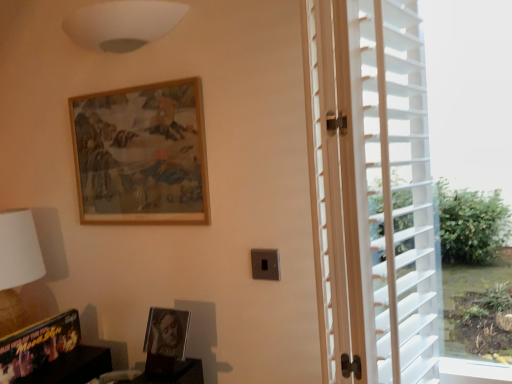
Question: Can you confirm if wooden frame at upper center, which is the third picture frame in bottom-to-top order, is positioned to the right of white matte lampshade at upper center?

Choices:
 (A) no
 (B) yes

Answer: (B)

Question: Can you confirm if wooden frame at upper center, placed as the 1th picture frame when sorted from top to bottom, is positioned to the left of white matte lampshade at upper center?

Choices:
 (A) no
 (B) yes

Answer: (A)

Question: Does wooden frame at upper center, placed as the 1th picture frame when sorted from top to bottom, come in front of white matte lampshade at upper center?

Choices:
 (A) yes
 (B) no

Answer: (B)

Question: Can you confirm if wooden frame at upper center, which is the third picture frame in bottom-to-top order, is wider than white matte lampshade at upper center?

Choices:
 (A) no
 (B) yes

Answer: (A)

Question: Is wooden frame at upper center, placed as the 1th picture frame when sorted from top to bottom, further to camera compared to white matte lampshade at upper center?

Choices:
 (A) yes
 (B) no

Answer: (A)

Question: Based on their sizes in the image, would you say white plastic blinds at right is bigger or smaller than dark wood bookshelf at lower left?

Choices:
 (A) big
 (B) small

Answer: (A)

Question: Considering the positions of white plastic blinds at right and dark wood bookshelf at lower left in the image, is white plastic blinds at right taller or shorter than dark wood bookshelf at lower left?

Choices:
 (A) short
 (B) tall

Answer: (B)

Question: Considering the positions of white plastic blinds at right and dark wood bookshelf at lower left in the image, is white plastic blinds at right wider or thinner than dark wood bookshelf at lower left?

Choices:
 (A) wide
 (B) thin

Answer: (B)

Question: Is point (506, 94) positioned closer to the camera than point (71, 350)?

Choices:
 (A) farther
 (B) closer

Answer: (B)

Question: Is white matte lampshade at upper center situated inside white fabric lampshade at left or outside?

Choices:
 (A) inside
 (B) outside

Answer: (B)

Question: Considering their positions, is white matte lampshade at upper center located in front of or behind white fabric lampshade at left?

Choices:
 (A) front
 (B) behind

Answer: (A)

Question: From the image's perspective, is white matte lampshade at upper center located above or below white fabric lampshade at left?

Choices:
 (A) below
 (B) above

Answer: (B)

Question: From their relative heights in the image, would you say white matte lampshade at upper center is taller or shorter than white fabric lampshade at left?

Choices:
 (A) tall
 (B) short

Answer: (B)

Question: Considering the positions of wooden frame at upper center, which is the third picture frame in bottom-to-top order, and wooden picture frame at lower left, the 1th picture frame in the bottom-to-top sequence, in the image, is wooden frame at upper center, which is the third picture frame in bottom-to-top order, bigger or smaller than wooden picture frame at lower left, the 1th picture frame in the bottom-to-top sequence,?

Choices:
 (A) small
 (B) big

Answer: (B)

Question: Choose the correct answer: Is wooden frame at upper center, placed as the 1th picture frame when sorted from top to bottom, inside wooden picture frame at lower left, the 1th picture frame in the bottom-to-top sequence, or outside it?

Choices:
 (A) inside
 (B) outside

Answer: (B)